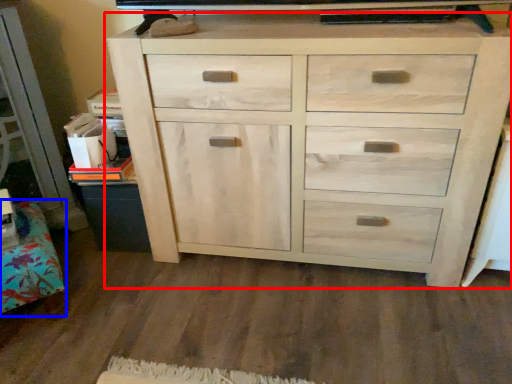
Question: Among these objects, which one is nearest to the camera, chest of drawers (highlighted by a red box) or cabinetry (highlighted by a blue box)?

Choices:
 (A) chest of drawers
 (B) cabinetry

Answer: (A)